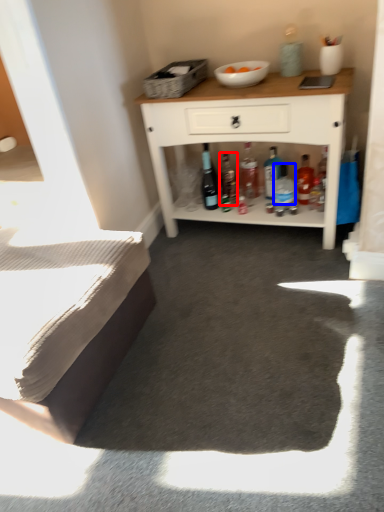
Question: Which object is further to the camera taking this photo, bottle (highlighted by a red box) or bottle (highlighted by a blue box)?

Choices:
 (A) bottle
 (B) bottle

Answer: (A)